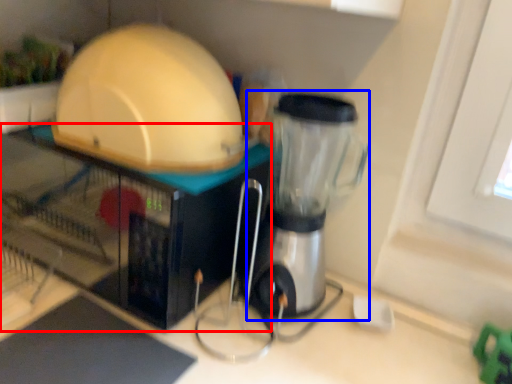
Question: Which object appears farthest to the camera in this image, appliance (highlighted by a red box) or blender (highlighted by a blue box)?

Choices:
 (A) appliance
 (B) blender

Answer: (A)